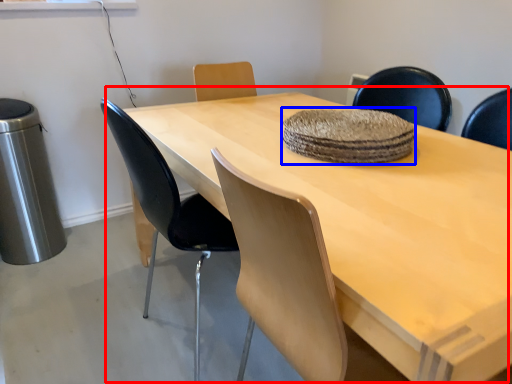
Question: Which of the following is the closest to the observer, table (highlighted by a red box) or mat (highlighted by a blue box)?

Choices:
 (A) table
 (B) mat

Answer: (A)